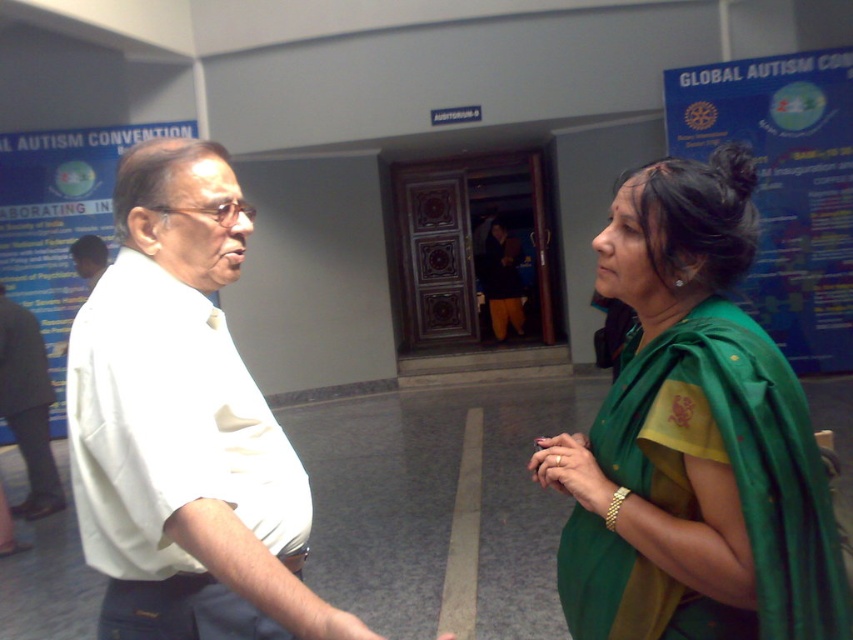
Question: From the image, what is the correct spatial relationship of green silk saree at center in relation to matte white shirt at center?

Choices:
 (A) left
 (B) right

Answer: (B)

Question: Which point is farther to the camera?

Choices:
 (A) green silk saree at center
 (B) white shirt at center

Answer: (A)

Question: Which object is farther from the camera taking this photo?

Choices:
 (A) green silk saree at center
 (B) white shirt at center
 (C) matte white shirt at center

Answer: (C)

Question: Which of these objects is positioned farthest from the matte white shirt at center?

Choices:
 (A) green silk saree at center
 (B) white shirt at center

Answer: (A)

Question: Where is green silk saree at center located in relation to white shirt at center in the image?

Choices:
 (A) right
 (B) left

Answer: (A)

Question: Can you confirm if green silk saree at center is wider than white shirt at center?

Choices:
 (A) yes
 (B) no

Answer: (B)